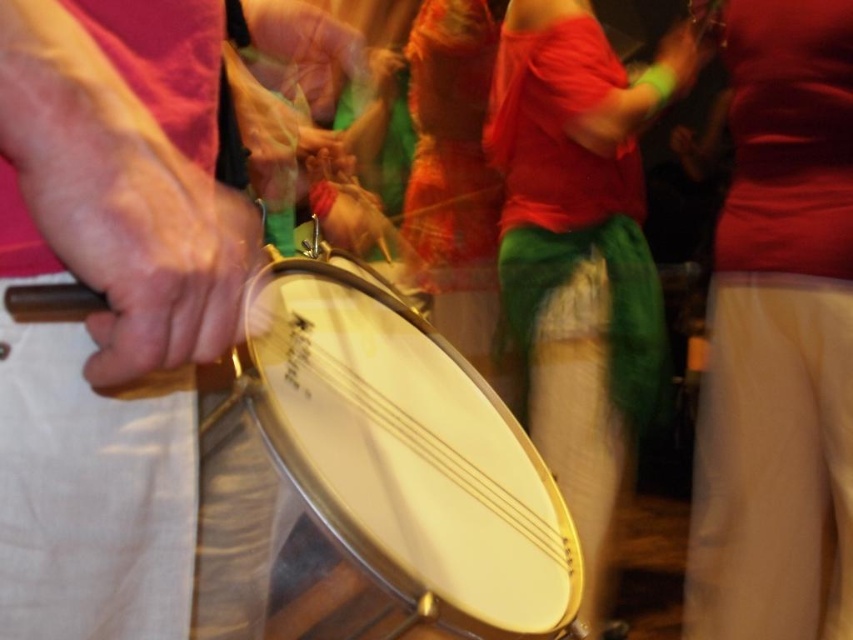
You are standing in front of the drum being played by the person in the pink shirt and white pants. The point at coordinates point (405, 320) is where you want to place a small decoration. If your hand is 0.5 meters away from your body, can you reach that point without moving your feet?

The point at coordinates point (405, 320) is 1.04 meters away from the viewer. Since your hand can only reach 0.5 meters, you cannot reach that point without moving your feet.

You are a photographer trying to capture the metallic drum at center and the matte green scarf at upper center in a new shot. Based on their positions in the original image, which object should you adjust your camera focus to first to ensure both are in frame?

The metallic drum at center is positioned on the left side of matte green scarf at upper center, so you should focus on the metallic drum at center first to ensure both objects are within the frame.

Based on the photo, you are a photographer adjusting your camera settings to capture the details of the matte black drumstick at left and the matte green scarf at upper center. Since you want both objects to be in focus, which object should you set the focus point closer to?

The matte black drumstick at left has a smaller size compared to the matte green scarf at upper center, so you should set the focus point closer to the matte black drumstick at left to ensure both objects are in focus.